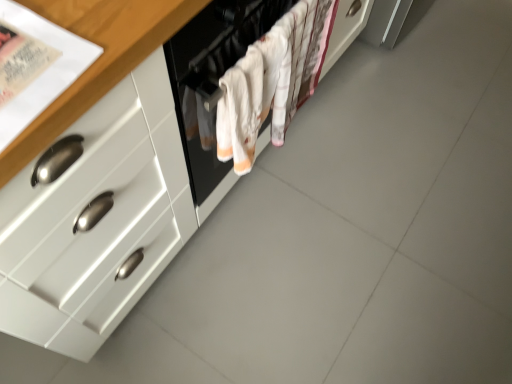
Question: Considering the relative sizes of white fabric oven at center and white glossy cabinet at center in the image provided, is white fabric oven at center thinner than white glossy cabinet at center?

Choices:
 (A) no
 (B) yes

Answer: (B)

Question: Could you tell me if white fabric oven at center is turned towards white glossy cabinet at center?

Choices:
 (A) no
 (B) yes

Answer: (B)

Question: Is there a large distance between white fabric oven at center and white glossy cabinet at center?

Choices:
 (A) yes
 (B) no

Answer: (B)

Question: Is white glossy cabinet at center at the back of white fabric oven at center?

Choices:
 (A) no
 (B) yes

Answer: (B)

Question: Does white fabric oven at center have a larger size compared to white glossy cabinet at center?

Choices:
 (A) no
 (B) yes

Answer: (A)

Question: Is white glossy cabinet at center surrounded by white fabric oven at center?

Choices:
 (A) yes
 (B) no

Answer: (B)

Question: Considering the relative sizes of white glossy cabinet at center and white fabric oven at center in the image provided, is white glossy cabinet at center shorter than white fabric oven at center?

Choices:
 (A) no
 (B) yes

Answer: (A)

Question: Is white glossy cabinet at center aimed at white fabric oven at center?

Choices:
 (A) no
 (B) yes

Answer: (B)

Question: Is white glossy cabinet at center to the left of white fabric oven at center from the viewer's perspective?

Choices:
 (A) no
 (B) yes

Answer: (B)

Question: Is white fabric oven at center at the back of white glossy cabinet at center?

Choices:
 (A) yes
 (B) no

Answer: (A)

Question: From a real-world perspective, is white glossy cabinet at center below white fabric oven at center?

Choices:
 (A) yes
 (B) no

Answer: (A)

Question: Can you confirm if white glossy cabinet at center is wider than white fabric oven at center?

Choices:
 (A) yes
 (B) no

Answer: (A)

Question: From a real-world perspective, is white fabric oven at center above or below white glossy cabinet at center?

Choices:
 (A) below
 (B) above

Answer: (B)